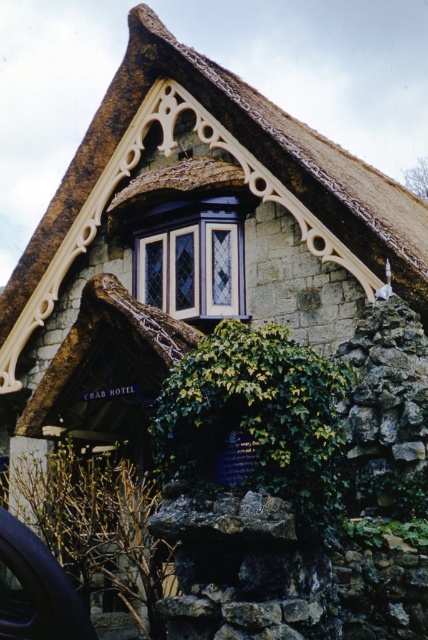
Who is positioned more to the right, clear glass window at center or shiny black car at lower left?

Positioned to the right is clear glass window at center.

Who is positioned more to the left, clear glass window at center or shiny black car at lower left?

shiny black car at lower left is more to the left.

Who is more forward, (201, 248) or (3, 579)?

Point (3, 579) is more forward.

You are a GUI agent. You are given a task and a screenshot of the screen. Output one action in this format:
    pyautogui.click(x=<x>, y=<y>)
    Task: Click on the clear glass window at center
    This screenshot has height=640, width=428.
    Given the screenshot: What is the action you would take?
    pyautogui.click(x=192, y=259)

Is the position of shiny black car at lower left less distant than that of transparent glass car window at lower left?

That is False.

Measure the distance between point (47, 611) and camera.

Point (47, 611) is 50.33 meters from camera.

Who is more forward, [11,595] or [3,616]?

Point [3,616] is more forward.

The width and height of the screenshot is (428, 640). I want to click on shiny black car at lower left, so click(x=35, y=589).

Is the position of green leafy ivy at center more distant than that of shiny black car at lower left?

Yes, green leafy ivy at center is further from the viewer.

Is green leafy ivy at center wider than shiny black car at lower left?

Indeed, green leafy ivy at center has a greater width compared to shiny black car at lower left.

Does point (342, 392) come behind point (70, 579)?

Yes.

Find the location of `green leafy ivy at center`. green leafy ivy at center is located at coordinates point(256,420).